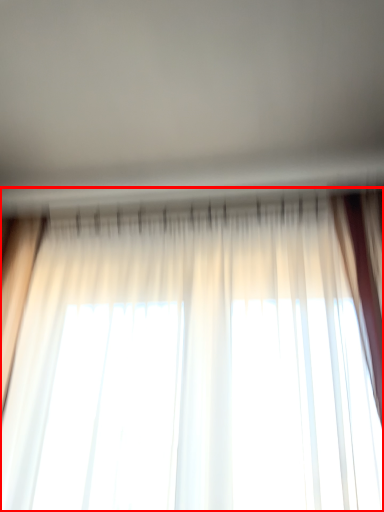
Question: From the image's perspective, considering the relative positions of curtain (annotated by the red box) and backdrop in the image provided, where is curtain (annotated by the red box) located with respect to the staircase?

Choices:
 (A) below
 (B) above

Answer: (A)